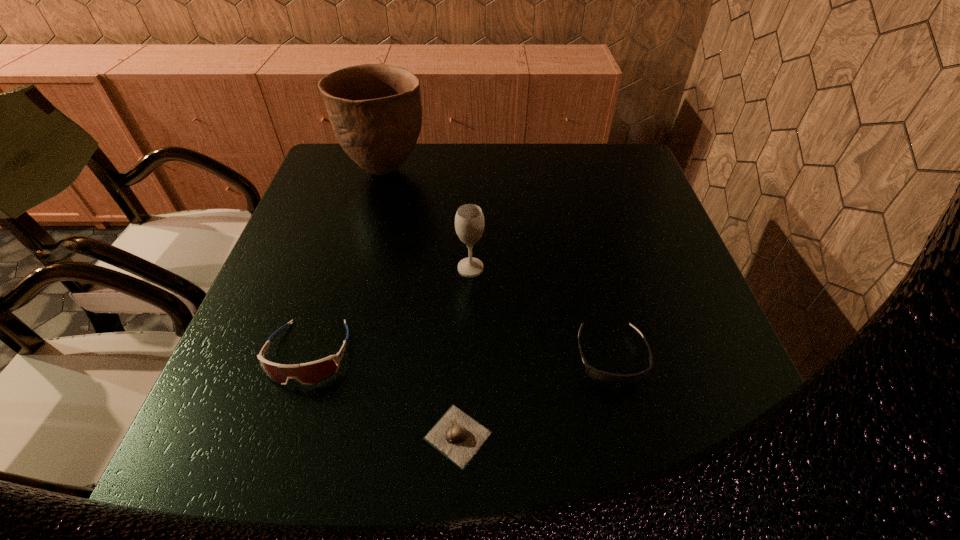
This screenshot has width=960, height=540. I want to click on vacant space positioned on the left of the farthest object, so click(x=324, y=170).

At what (x,y) coordinates should I click in order to perform the action: click on vacant space located on the right of the wineglass. Please return your answer as a coordinate pair (x, y). Looking at the image, I should click on (556, 268).

Locate an element on the screen. The image size is (960, 540). vacant space located on the front-facing side of the taller goggles is located at coordinates (285, 428).

This screenshot has width=960, height=540. Identify the location of blank space located on the lenses of the second shortest object. (630, 435).

The image size is (960, 540). In order to click on vacant space located on the back of the nearest object in this screenshot , I will do `click(460, 374)`.

Identify the location of object at the far edge. (375, 110).

At what (x,y) coordinates should I click in order to perform the action: click on object that is at the near edge. Please return your answer as a coordinate pair (x, y). Looking at the image, I should click on (456, 435).

This screenshot has width=960, height=540. Identify the location of pottery that is positioned at the left edge. pyautogui.click(x=375, y=110).

You are a GUI agent. You are given a task and a screenshot of the screen. Output one action in this format:
    pyautogui.click(x=<x>, y=<y>)
    Task: Click on the goggles positioned at the left edge
    
    Given the screenshot: What is the action you would take?
    pyautogui.click(x=309, y=373)

Locate an element on the screen. Image resolution: width=960 pixels, height=540 pixels. object present at the right edge is located at coordinates (609, 379).